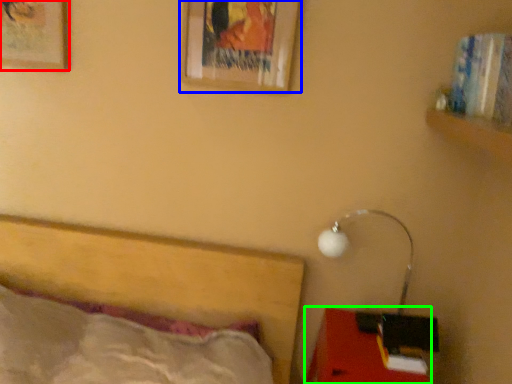
Question: Which object is positioned farthest from picture frame (highlighted by a red box)? Select from picture frame (highlighted by a blue box) and furniture (highlighted by a green box).

Choices:
 (A) picture frame
 (B) furniture

Answer: (B)